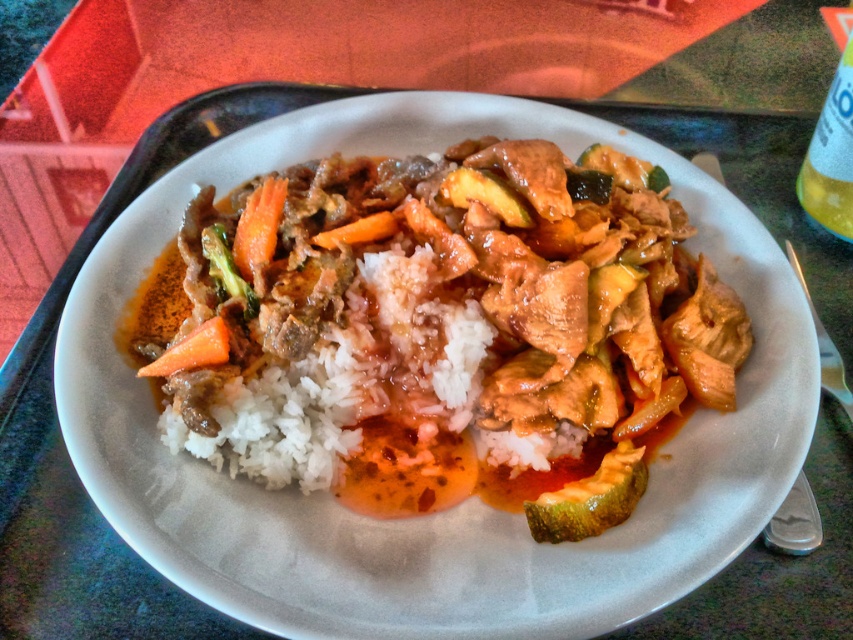
Question: Among these points, which one is farthest from the camera?

Choices:
 (A) click(x=202, y=326)
 (B) click(x=851, y=221)
 (C) click(x=264, y=237)

Answer: (B)

Question: Is white rice at center below orange smooth carrot at center?

Choices:
 (A) no
 (B) yes

Answer: (B)

Question: Can you confirm if green matte cucumber at center is positioned to the left of translucent plastic bottle at upper right?

Choices:
 (A) no
 (B) yes

Answer: (B)

Question: Among these points, which one is nearest to the camera?

Choices:
 (A) (535, 513)
 (B) (212, 381)

Answer: (A)

Question: Can you confirm if translucent plastic bottle at upper right is positioned below green glossy broccoli at center?

Choices:
 (A) yes
 (B) no

Answer: (B)

Question: Among these objects, which one is farthest from the camera?

Choices:
 (A) translucent plastic bottle at upper right
 (B) orange smooth carrot at center
 (C) white rice at center

Answer: (B)